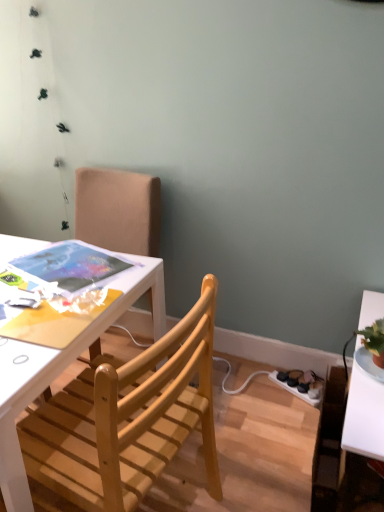
Question: Can you confirm if wooden chair at upper left, which is counted as the first chair, starting from the back, is positioned to the right of white plastic power outlet at lower right?

Choices:
 (A) no
 (B) yes

Answer: (A)

Question: Does wooden chair at upper left, which is counted as the first chair, starting from the back, touch white plastic power outlet at lower right?

Choices:
 (A) no
 (B) yes

Answer: (A)

Question: Is wooden chair at upper left, the second chair from the front, to the left of white plastic power outlet at lower right from the viewer's perspective?

Choices:
 (A) no
 (B) yes

Answer: (B)

Question: Considering the relative sizes of wooden chair at upper left, which is counted as the first chair, starting from the back, and white plastic power outlet at lower right in the image provided, is wooden chair at upper left, which is counted as the first chair, starting from the back, thinner than white plastic power outlet at lower right?

Choices:
 (A) yes
 (B) no

Answer: (B)

Question: Considering the relative sizes of wooden chair at upper left, the second chair from the front, and white plastic power outlet at lower right in the image provided, is wooden chair at upper left, the second chair from the front, bigger than white plastic power outlet at lower right?

Choices:
 (A) yes
 (B) no

Answer: (A)

Question: Is white plastic power outlet at lower right to the left or to the right of wooden chair at upper left, the second chair from the front, in the image?

Choices:
 (A) right
 (B) left

Answer: (A)

Question: In terms of height, does white plastic power outlet at lower right look taller or shorter compared to wooden chair at upper left, the second chair from the front?

Choices:
 (A) short
 (B) tall

Answer: (A)

Question: From the image's perspective, is white plastic power outlet at lower right located above or below wooden chair at upper left, which is counted as the first chair, starting from the back?

Choices:
 (A) below
 (B) above

Answer: (A)

Question: In the image, is white plastic power outlet at lower right positioned in front of or behind wooden chair at upper left, which is counted as the first chair, starting from the back?

Choices:
 (A) front
 (B) behind

Answer: (B)

Question: Is light wood chair at center, which is the 1th chair in front-to-back order, inside the boundaries of wooden chair at upper left, which is counted as the first chair, starting from the back, or outside?

Choices:
 (A) inside
 (B) outside

Answer: (B)

Question: Is light wood chair at center, arranged as the second chair when viewed from the back, in front of or behind wooden chair at upper left, which is counted as the first chair, starting from the back, in the image?

Choices:
 (A) behind
 (B) front

Answer: (B)

Question: Considering the positions of point (102, 487) and point (135, 217), is point (102, 487) closer or farther from the camera than point (135, 217)?

Choices:
 (A) farther
 (B) closer

Answer: (B)

Question: Considering the positions of light wood chair at center, arranged as the second chair when viewed from the back, and wooden chair at upper left, the second chair from the front, in the image, is light wood chair at center, arranged as the second chair when viewed from the back, bigger or smaller than wooden chair at upper left, the second chair from the front,?

Choices:
 (A) small
 (B) big

Answer: (A)

Question: Which is correct: light wood chair at center, which is the 1th chair in front-to-back order, is inside white plastic power outlet at lower right, or outside of it?

Choices:
 (A) inside
 (B) outside

Answer: (B)

Question: Is light wood chair at center, which is the 1th chair in front-to-back order, wider or thinner than white plastic power outlet at lower right?

Choices:
 (A) wide
 (B) thin

Answer: (A)